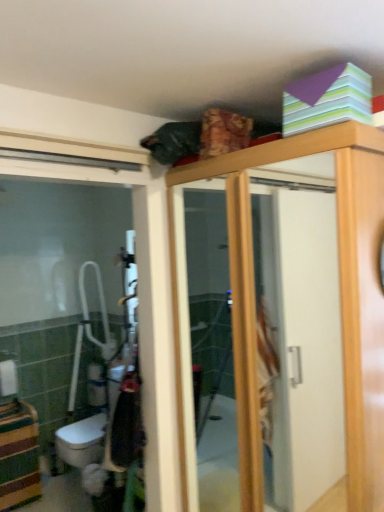
Describe the element at coordinates (254, 304) in the screenshot. I see `wooden screen door at upper center` at that location.

This screenshot has width=384, height=512. In order to click on wooden screen door at upper center in this screenshot , I will do `click(254, 304)`.

This screenshot has width=384, height=512. I want to click on wooden screen door at upper center, so click(x=254, y=304).